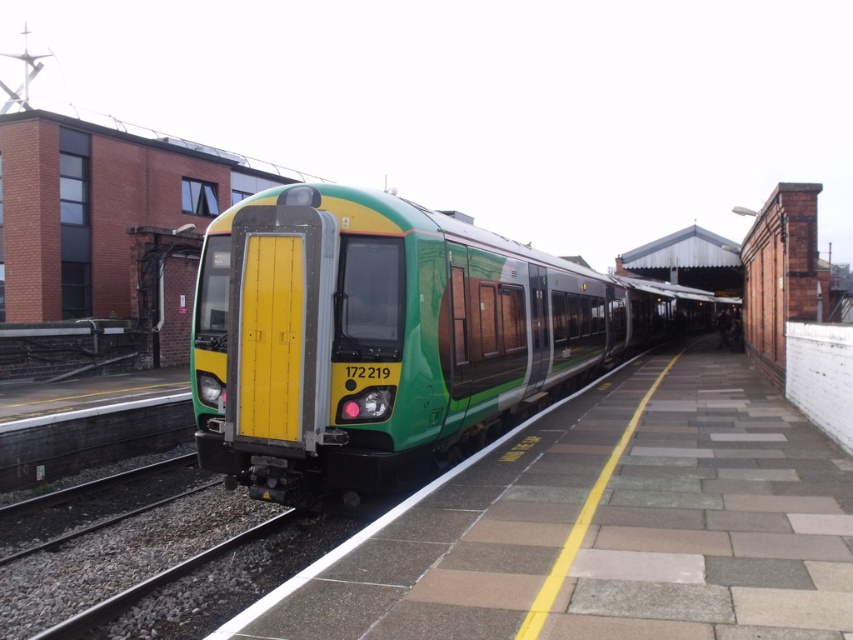
Can you confirm if green matte platform at center is taller than green matte train at center?

No, green matte platform at center is not taller than green matte train at center.

Locate an element on the screen. green matte platform at center is located at coordinates (602, 525).

The image size is (853, 640). What are the coordinates of `green matte platform at center` in the screenshot? It's located at (602, 525).